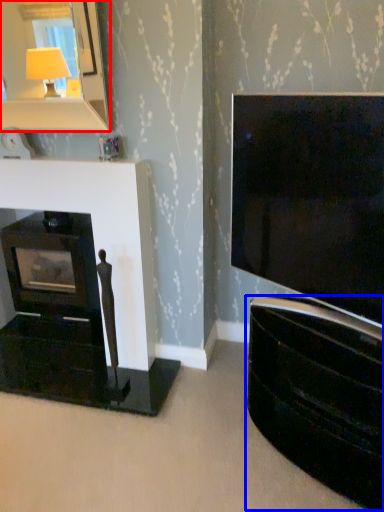
Question: Which point is further to the camera, mirror (highlighted by a red box) or tv cabinet (highlighted by a blue box)?

Choices:
 (A) mirror
 (B) tv cabinet

Answer: (A)